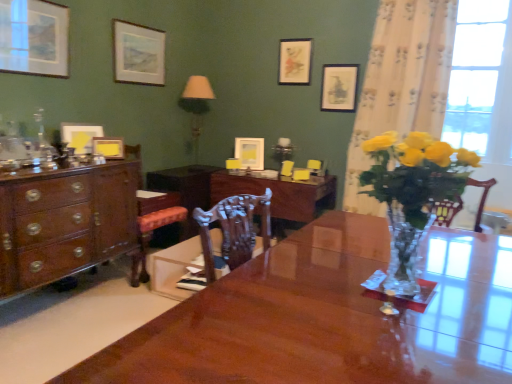
Image resolution: width=512 pixels, height=384 pixels. Identify the location of free space in front of translucent glass vase at center. (418, 340).